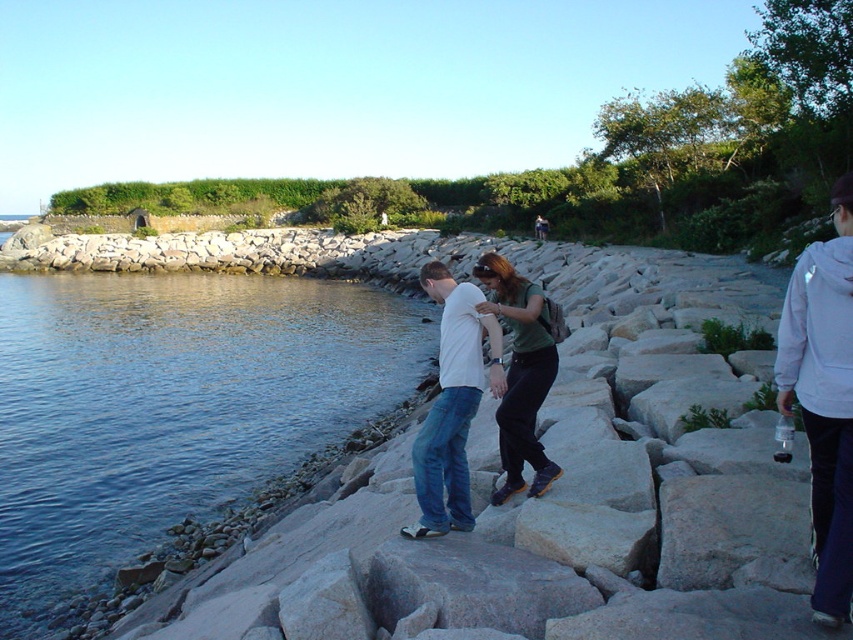
You are a photographer trying to capture a candid shot of two people wearing the white cotton shirt at center and the green fabric shirt at center. Since you want to focus on the person in the narrower shirt, which one should you aim your camera at?

The white cotton shirt at center has a lesser width compared to the green fabric shirt at center, so you should aim your camera at the white cotton shirt at center to focus on the person wearing the narrower shirt.

You are a photographer trying to capture both the white fleece jacket at right and the white cotton shirt at center in your shot. Which object should you focus on first if you want to ensure both are in frame?

The white fleece jacket at right is not as tall as the white cotton shirt at center, so you should focus on the white cotton shirt at center first to ensure both are in frame.